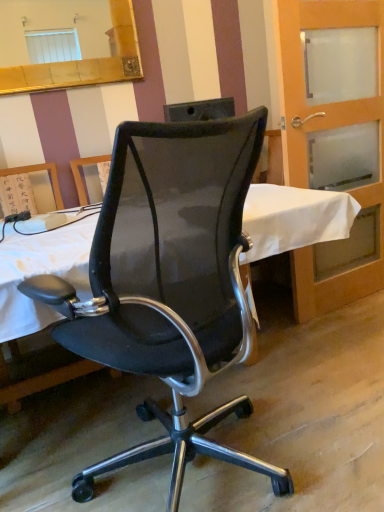
Question: Considering the positions of translucent glass door at right and gold-framed mirror at upper left in the image, is translucent glass door at right wider or thinner than gold-framed mirror at upper left?

Choices:
 (A) wide
 (B) thin

Answer: (A)

Question: From their relative heights in the image, would you say translucent glass door at right is taller or shorter than gold-framed mirror at upper left?

Choices:
 (A) short
 (B) tall

Answer: (B)

Question: Which is nearer to the translucent glass door at right?

Choices:
 (A) black mesh office chair at center
 (B) gold-framed mirror at upper left

Answer: (B)

Question: Which object is the closest to the gold-framed mirror at upper left?

Choices:
 (A) translucent glass door at right
 (B) black mesh office chair at center

Answer: (A)